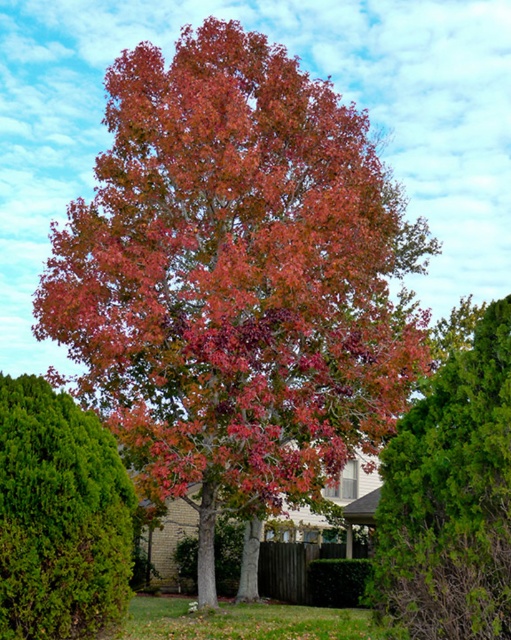
You are standing in the autumn scene and see a green textured bush at lower left located at point (59,516). Is there any object in the scene that is closer to you than this point?

The green textured bush at lower left is located at point (59,516). Since the coordinate system is not provided, it is impossible to determine if any object is closer to you than this point without additional information about the scene layout.